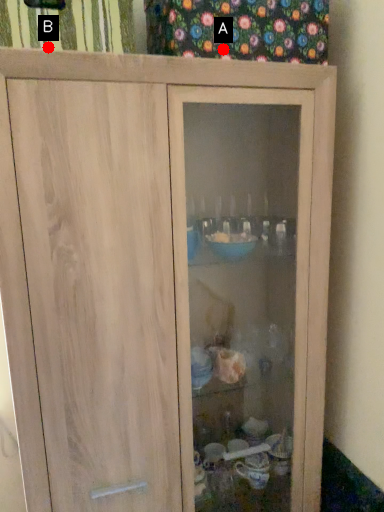
Question: Two points are circled on the image, labeled by A and B beside each circle. Which point is farther from the camera taking this photo?

Choices:
 (A) A is further
 (B) B is further

Answer: (A)